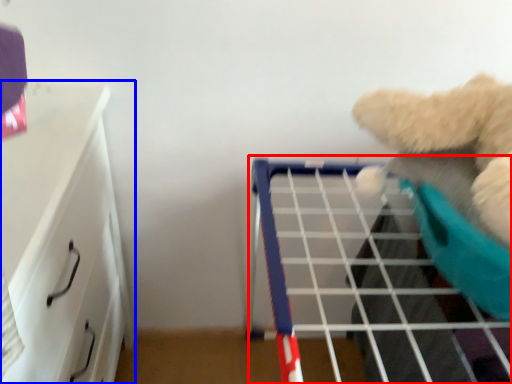
Question: Which object appears farthest to the camera in this image, shelf (highlighted by a red box) or furniture (highlighted by a blue box)?

Choices:
 (A) shelf
 (B) furniture

Answer: (A)